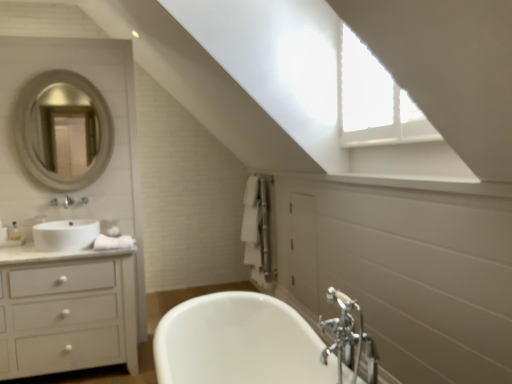
Question: Is white glossy cabinet at left turned away from silver metallic mirror at upper left?

Choices:
 (A) yes
 (B) no

Answer: (B)

Question: Does white glossy cabinet at left have a greater height compared to silver metallic mirror at upper left?

Choices:
 (A) no
 (B) yes

Answer: (A)

Question: Is white glossy cabinet at left beside silver metallic mirror at upper left?

Choices:
 (A) yes
 (B) no

Answer: (B)

Question: Is white glossy cabinet at left further to camera compared to silver metallic mirror at upper left?

Choices:
 (A) no
 (B) yes

Answer: (A)

Question: Is white glossy cabinet at left wider than silver metallic mirror at upper left?

Choices:
 (A) yes
 (B) no

Answer: (A)

Question: Is point (50, 248) closer or farther from the camera than point (352, 352)?

Choices:
 (A) closer
 (B) farther

Answer: (B)

Question: In the image, is white glossy sink at left on the left side or the right side of chrome metallic faucet at lower right?

Choices:
 (A) right
 (B) left

Answer: (B)

Question: Considering the positions of white glossy sink at left and chrome metallic faucet at lower right in the image, is white glossy sink at left bigger or smaller than chrome metallic faucet at lower right?

Choices:
 (A) small
 (B) big

Answer: (B)

Question: From the image's perspective, is white glossy sink at left located above or below chrome metallic faucet at lower right?

Choices:
 (A) below
 (B) above

Answer: (B)

Question: Is white glossy cabinet at left spatially inside silver metallic mirror at upper left, or outside of it?

Choices:
 (A) inside
 (B) outside

Answer: (B)

Question: Looking at their shapes, would you say white glossy cabinet at left is wider or thinner than silver metallic mirror at upper left?

Choices:
 (A) thin
 (B) wide

Answer: (B)

Question: Would you say white glossy cabinet at left is to the left or to the right of silver metallic mirror at upper left in the picture?

Choices:
 (A) right
 (B) left

Answer: (A)

Question: From their relative heights in the image, would you say white glossy cabinet at left is taller or shorter than silver metallic mirror at upper left?

Choices:
 (A) short
 (B) tall

Answer: (A)

Question: Is point (75, 301) positioned closer to the camera than point (81, 221)?

Choices:
 (A) closer
 (B) farther

Answer: (A)

Question: Choose the correct answer: Is white glossy cabinet at left inside white glossy sink at left or outside it?

Choices:
 (A) inside
 (B) outside

Answer: (B)